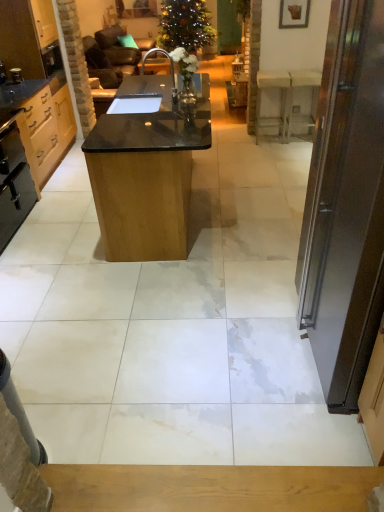
Question: In terms of width, does dark brown wooden door at right look wider or thinner when compared to green matte christmas tree at upper center?

Choices:
 (A) thin
 (B) wide

Answer: (A)

Question: From a real-world perspective, relative to green matte christmas tree at upper center, is dark brown wooden door at right vertically above or below?

Choices:
 (A) below
 (B) above

Answer: (B)

Question: Which object is positioned farthest from the green matte christmas tree at upper center?

Choices:
 (A) metallic knob at left, positioned as the 2th appliance in bottom-to-top order
 (B) white marble table at right, the 1th table from the right
 (C) light wood cabinet at left, which is the first cabinetry from top to bottom
 (D) black polished wood table at center, which is the first table from front to back
 (E) dark brown wooden door at right

Answer: (E)

Question: Which object is positioned closest to the light wood cabinet at left, which is the first cabinetry from top to bottom?

Choices:
 (A) black matte oven at left, the first appliance positioned from the front
 (B) green matte christmas tree at upper center
 (C) black granite sink at center
 (D) metallic knob at left, the first appliance from the top
 (E) dark brown wooden door at right

Answer: (A)